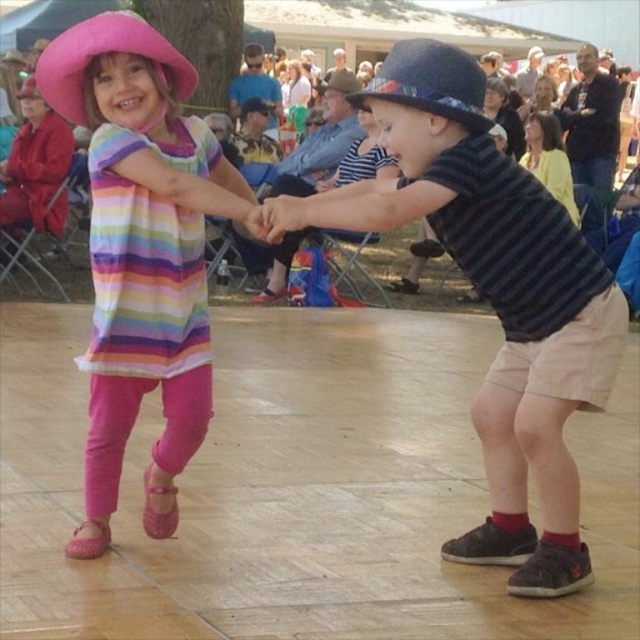
This screenshot has height=640, width=640. What do you see at coordinates (492, 298) in the screenshot?
I see `striped cotton shirt at center` at bounding box center [492, 298].

Looking at this image, which is below, striped cotton shirt at center or velvet blue hat at upper center?

Positioned lower is striped cotton shirt at center.

You are a GUI agent. You are given a task and a screenshot of the screen. Output one action in this format:
    pyautogui.click(x=<x>, y=<y>)
    Task: Click on the striped cotton shirt at center
    
    Given the screenshot: What is the action you would take?
    [492, 298]

Locate an element on the screen. Image resolution: width=640 pixels, height=640 pixels. striped cotton shirt at center is located at coordinates click(x=492, y=298).

Which is more to the left, velvet blue hat at upper center or pink fabric hat at upper left?

pink fabric hat at upper left

Who is more forward, (346, 92) or (28, 81)?

Positioned in front is point (346, 92).

I want to click on velvet blue hat at upper center, so click(340, 81).

What do you see at coordinates (492, 298) in the screenshot? Image resolution: width=640 pixels, height=640 pixels. I see `striped cotton shirt at center` at bounding box center [492, 298].

Does point (433, 141) come farther from viewer compared to point (193, 428)?

No, it is in front of (193, 428).

Locate an element on the screen. striped cotton shirt at center is located at coordinates (492, 298).